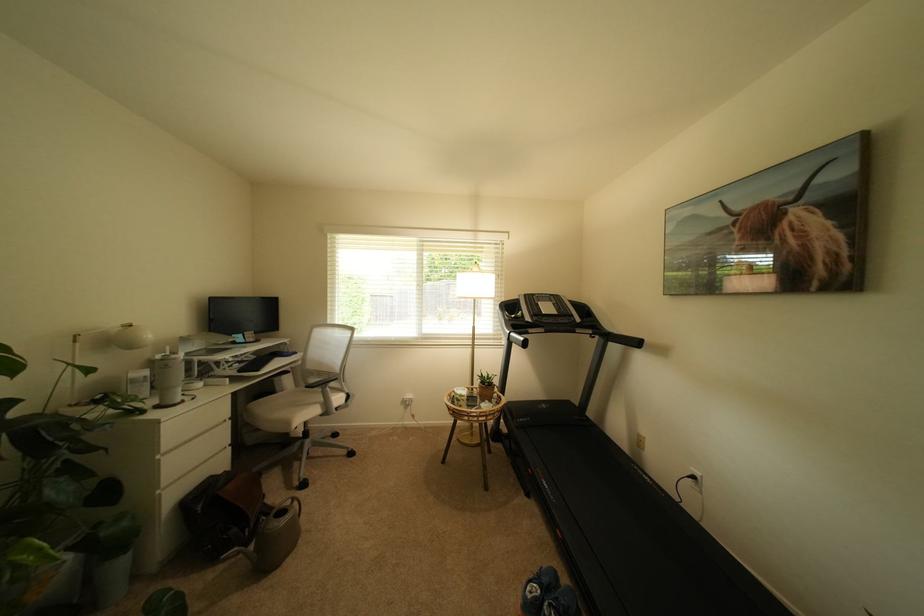
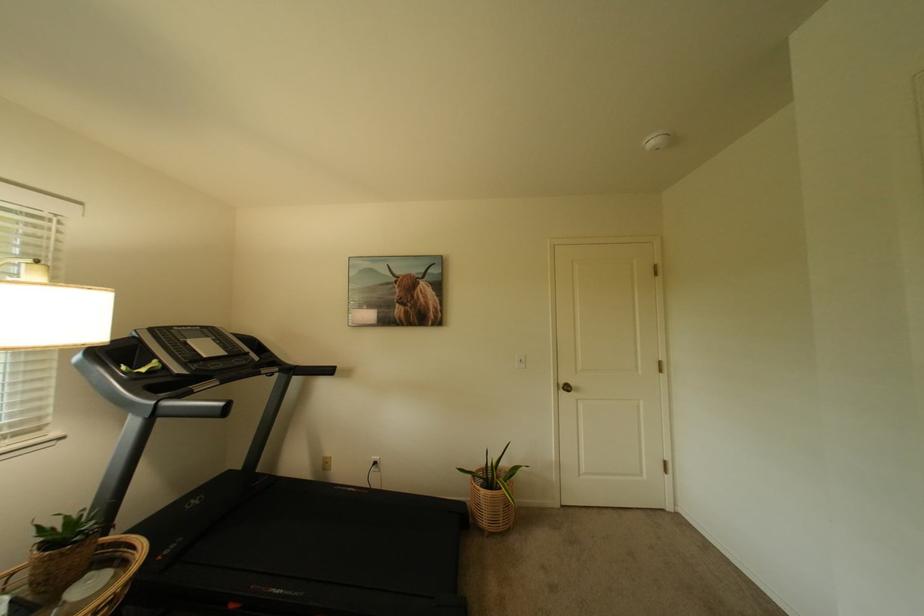
Where in the second image is the point corresponding to point (489, 408) from the first image?

(73, 605)